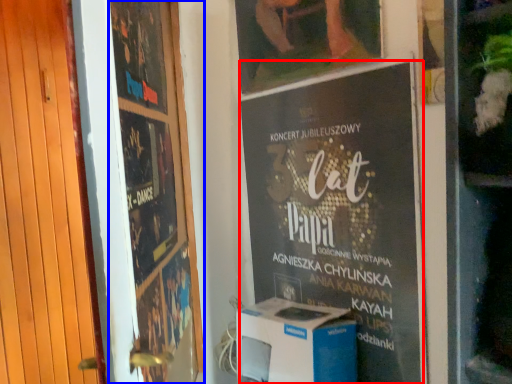
Question: Which object appears closest to the camera in this image, poster (highlighted by a red box) or poster (highlighted by a blue box)?

Choices:
 (A) poster
 (B) poster

Answer: (B)